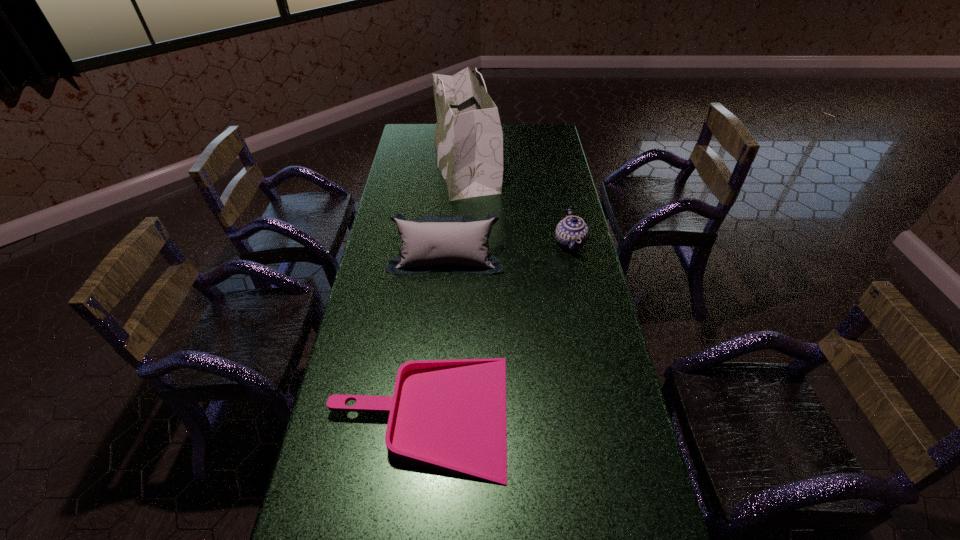
Identify the location of empty space that is in between the rightmost object and the shortest object. This screenshot has width=960, height=540. (494, 329).

You are a GUI agent. You are given a task and a screenshot of the screen. Output one action in this format:
    pyautogui.click(x=<x>, y=<y>)
    Task: Click on the vacant space that's between the farthest object and the chinaware
    The image size is (960, 540).
    Given the screenshot: What is the action you would take?
    pyautogui.click(x=517, y=204)

This screenshot has height=540, width=960. What are the coordinates of `vacant space that is in between the grocery bag and the cushion` in the screenshot? It's located at (456, 211).

This screenshot has height=540, width=960. Identify the location of empty space that is in between the cushion and the tallest object. (456, 211).

You are a GUI agent. You are given a task and a screenshot of the screen. Output one action in this format:
    pyautogui.click(x=<x>, y=<y>)
    Task: Click on the vacant region between the dustpan and the cushion
    This screenshot has height=540, width=960.
    Given the screenshot: What is the action you would take?
    pyautogui.click(x=433, y=337)

I want to click on vacant area between the third shortest object and the shortest object, so click(x=433, y=337).

Find the location of a particular element. The width and height of the screenshot is (960, 540). free space between the cushion and the dustpan is located at coordinates (433, 337).

The image size is (960, 540). Find the location of `unoccupied area between the shortest object and the second tallest object`. unoccupied area between the shortest object and the second tallest object is located at coordinates (433, 337).

This screenshot has width=960, height=540. Find the location of `free space between the tallest object and the chinaware`. free space between the tallest object and the chinaware is located at coordinates (517, 204).

Select which object is the third closest to the third shortest object. Please provide its 2D coordinates. Your answer should be formatted as a tuple, i.e. [(x, y)], where the tuple contains the x and y coordinates of a point satisfying the conditions above.

[(449, 415)]